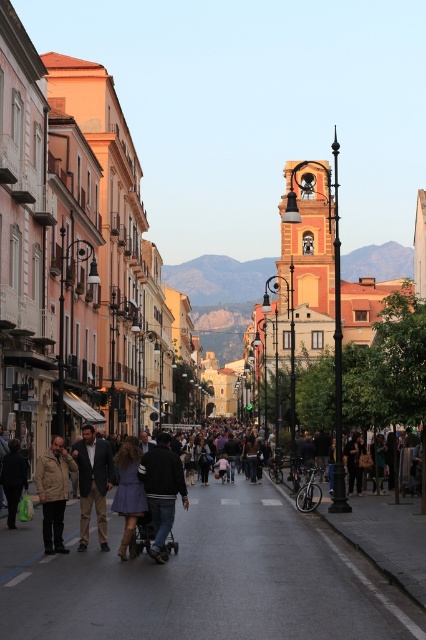
You are standing at the point marked by the coordinates (382, 524) in the image. What is the color of the clothing item located exactly at this point?

The point marked by the coordinates (382, 524) corresponds to the dark blue dress at center, so the color of the clothing item there is dark blue.

You are a tourist standing on the street and want to take a photo of both the gold metallic bell tower at center and the purple matte dress at center. Which object should you focus on first to ensure both are in the frame?

You should focus on the gold metallic bell tower at center first because it is taller than the purple matte dress at center, so adjusting the camera angle to include its height will naturally accommodate the shorter dress in the frame.

You are a fashion designer observing a crowd in a European town. You notice a dark blue dress at center and a khaki cotton jacket at center. Which clothing item appears larger in size?

The dark blue dress at center is bigger than the khaki cotton jacket at center, so the dark blue dress at center appears larger in size.